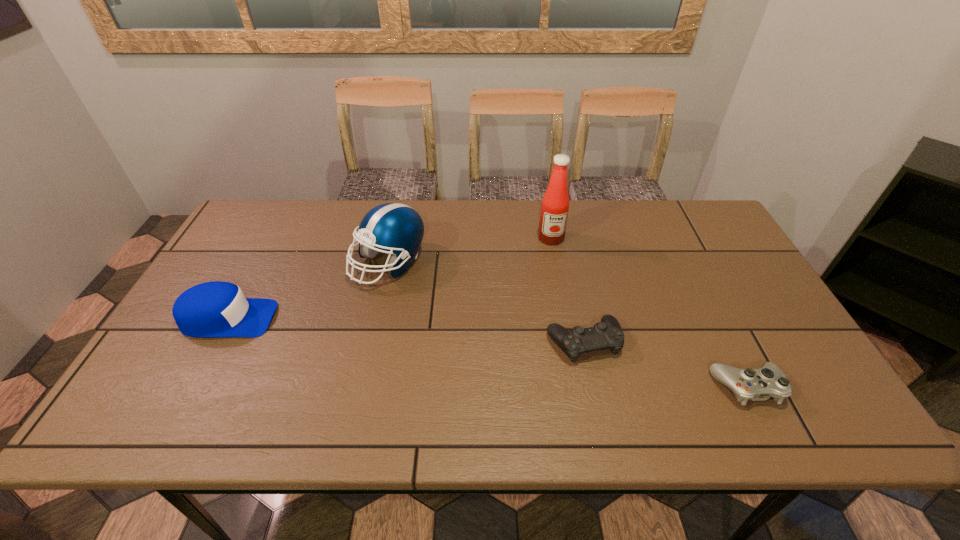
Identify the location of free spot that satisfies the following two spatial constraints: 1. on the front-facing side of the leftmost object; 2. on the left side of the left control. Image resolution: width=960 pixels, height=540 pixels. (216, 342).

At what (x,y) coordinates should I click in order to perform the action: click on free space that satisfies the following two spatial constraints: 1. on the front-facing side of the third shortest object; 2. on the left side of the rightmost object. Please return your answer as a coordinate pair (x, y). Image resolution: width=960 pixels, height=540 pixels. Looking at the image, I should click on (191, 387).

Image resolution: width=960 pixels, height=540 pixels. In order to click on free location that satisfies the following two spatial constraints: 1. at the front of the nearest object with the faceguard; 2. on the right side of the football helmet in this screenshot , I will do `click(361, 387)`.

Locate an element on the screen. free space that satisfies the following two spatial constraints: 1. on the front-facing side of the third shortest object; 2. on the back side of the rightmost object is located at coordinates (191, 387).